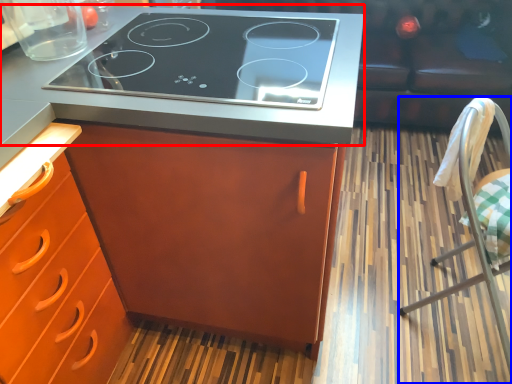
Question: Which object is further to the camera taking this photo, countertop (highlighted by a red box) or chair (highlighted by a blue box)?

Choices:
 (A) countertop
 (B) chair

Answer: (A)